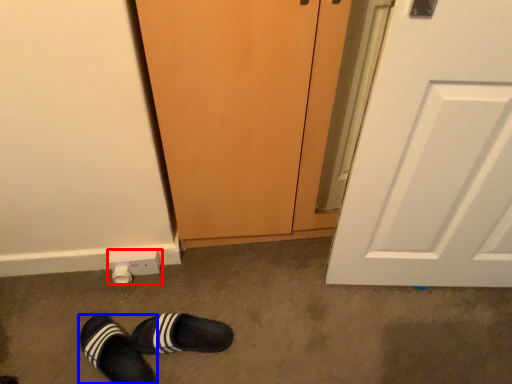
Question: Which object is closer to the camera taking this photo, electric outlet (highlighted by a red box) or footwear (highlighted by a blue box)?

Choices:
 (A) electric outlet
 (B) footwear

Answer: (B)